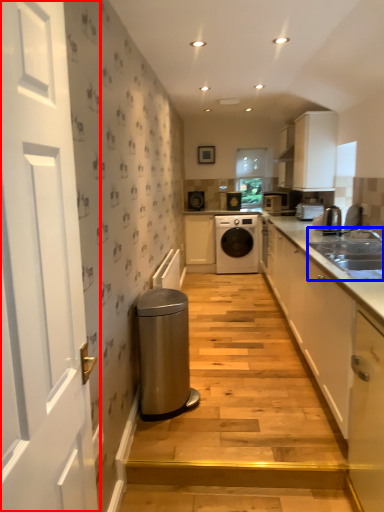
Question: Among these objects, which one is farthest to the camera, door (highlighted by a red box) or sink (highlighted by a blue box)?

Choices:
 (A) door
 (B) sink

Answer: (B)